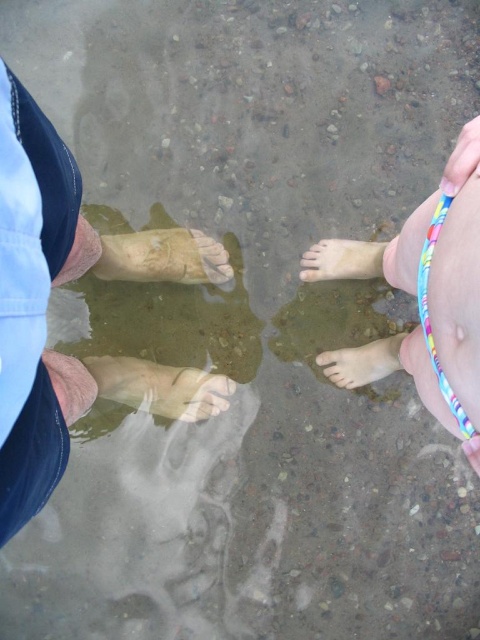
Is point (16, 362) farther from camera compared to point (202, 234)?

No, (16, 362) is in front of (202, 234).

How distant is brown skin feet at left from yellow matte sand at center?

brown skin feet at left and yellow matte sand at center are 7.04 inches apart.

Does point (74, 358) lie behind point (158, 262)?

No, (74, 358) is closer to viewer.

Where is `brown skin feet at left`? The image size is (480, 640). brown skin feet at left is located at coordinates tap(46, 308).

Is smooth skin feet at right further to camera compared to yellow matte sand at center?

No.

From the picture: Can you confirm if smooth skin feet at right is wider than yellow matte sand at center?

Incorrect, smooth skin feet at right's width does not surpass yellow matte sand at center's.

Between point (441, 211) and point (108, 250), which one is positioned behind?

Point (108, 250)

Image resolution: width=480 pixels, height=640 pixels. Identify the location of smooth skin feet at right. (425, 296).

What do you see at coordinates (160, 387) in the screenshot? I see `pale skin foot at lower center` at bounding box center [160, 387].

Is point (218, 396) more distant than point (351, 365)?

Yes, point (218, 396) is farther from viewer.

Is point (105, 385) behind point (347, 358)?

No, (105, 385) is in front of (347, 358).

This screenshot has width=480, height=640. I want to click on pale skin foot at lower center, so click(160, 387).